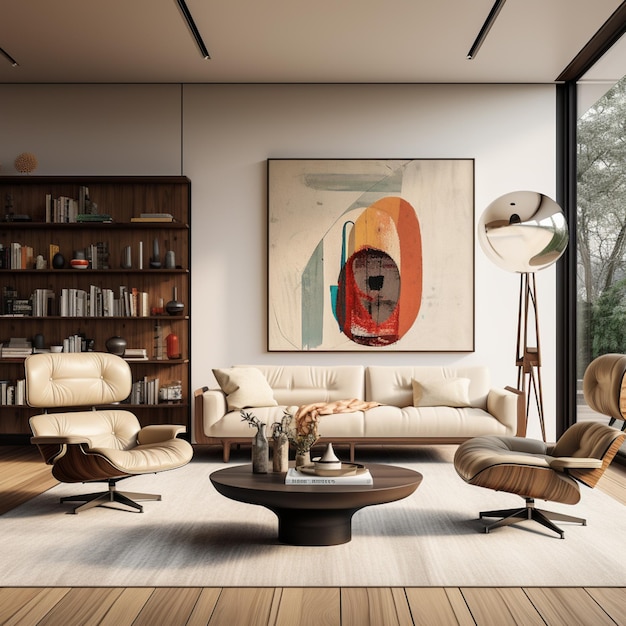
This screenshot has width=626, height=626. In order to click on rug in this screenshot , I will do `click(332, 551)`.